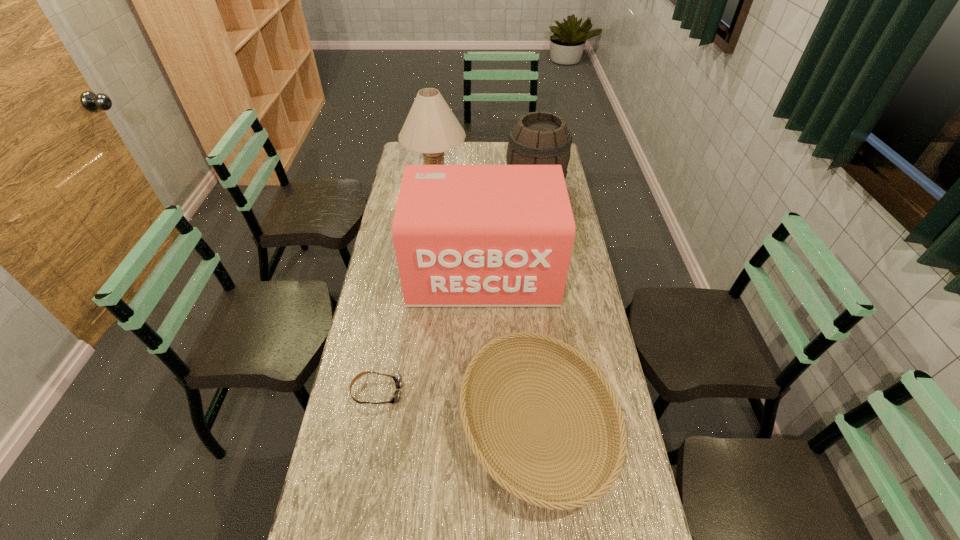
Locate an element on the screen. This screenshot has width=960, height=540. vacant space in between the basket and the shortest object is located at coordinates (457, 408).

Identify the location of object that stands as the closest to the box. The image size is (960, 540). (617, 433).

Locate which object ranks in proximity to the goggles. Please provide its 2D coordinates. Your answer should be formatted as a tuple, i.e. [(x, y)], where the tuple contains the x and y coordinates of a point satisfying the conditions above.

[(617, 433)]